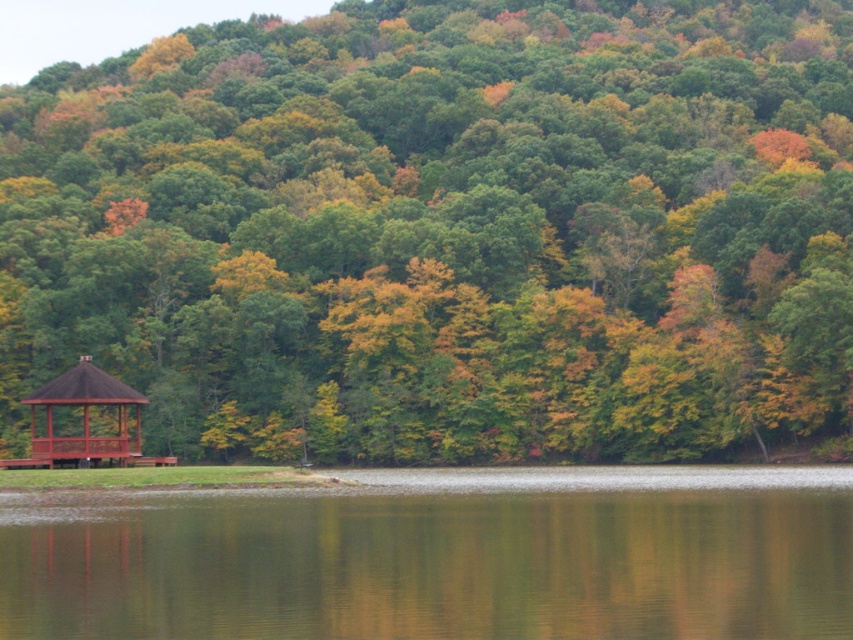
Question: Which point is closer to the camera?

Choices:
 (A) (138, 401)
 (B) (161, 256)
 (C) (708, 634)

Answer: (C)

Question: Where is green matte gazebo at lower left located in relation to brown wooden gazebo at left in the image?

Choices:
 (A) above
 (B) below

Answer: (A)

Question: Can you confirm if green matte gazebo at lower left is positioned below brown wooden gazebo at left?

Choices:
 (A) yes
 (B) no

Answer: (B)

Question: Which point is closer to the camera taking this photo?

Choices:
 (A) (73, 451)
 (B) (552, 561)
 (C) (206, 435)

Answer: (B)

Question: Which point appears closest to the camera in this image?

Choices:
 (A) (392, 481)
 (B) (102, 385)
 (C) (804, 33)

Answer: (A)

Question: Is green reflective water at lower center behind brown wooden gazebo at left?

Choices:
 (A) yes
 (B) no

Answer: (B)